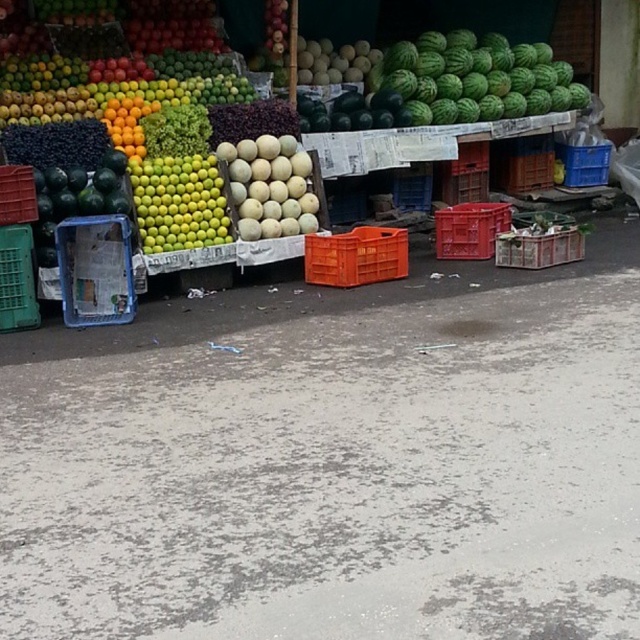
From the picture: You are standing at the fruit stall and want to pick up an item. There are two points marked on the ground where items are placed. The first point is at coordinates point (278, 202) and the second is at point (456, 225). Which point is closer to you?

Point (278, 202) is closer to the camera than point (456, 225), so the item at point (278, 202) is closer to you.